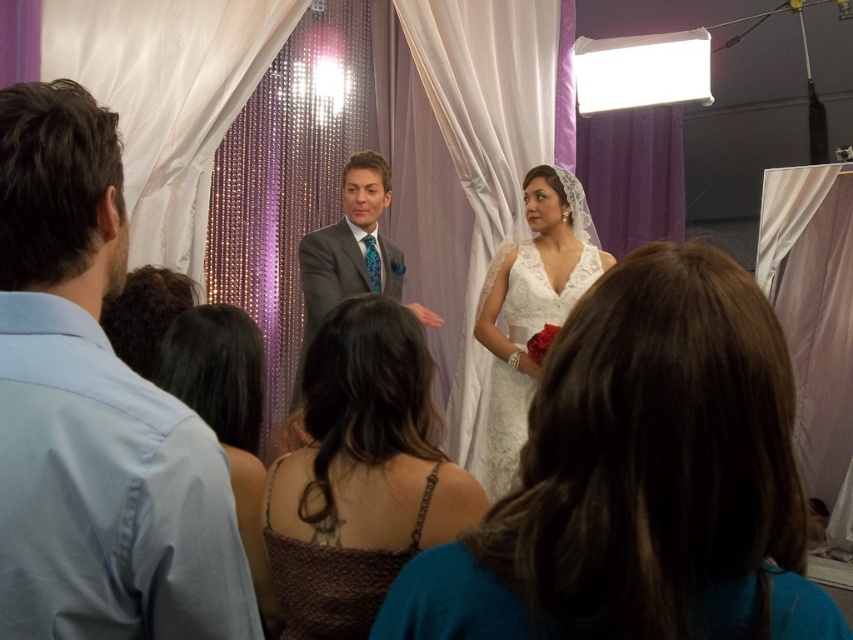
Which is below, light blue shirt at left or lace fabric dress at center?

Positioned lower is lace fabric dress at center.

Can you confirm if light blue shirt at left is thinner than lace fabric dress at center?

Indeed, light blue shirt at left has a lesser width compared to lace fabric dress at center.

Is point (82, 173) in front of point (491, 412)?

Yes, it is.

I want to click on light blue shirt at left, so click(94, 412).

Who is more forward, (544, 301) or (311, 317)?

Positioned in front is point (544, 301).

Can you confirm if lace fabric dress at center is smaller than gray suit at center?

Actually, lace fabric dress at center might be larger than gray suit at center.

Locate an element on the screen. The height and width of the screenshot is (640, 853). lace fabric dress at center is located at coordinates (531, 308).

From the picture: How far apart are white lace dress at center and light blue shirt at left?

A distance of 15.65 inches exists between white lace dress at center and light blue shirt at left.

The height and width of the screenshot is (640, 853). What do you see at coordinates (641, 480) in the screenshot? I see `white lace dress at center` at bounding box center [641, 480].

Does point (538, 620) come behind point (15, 292)?

No, (538, 620) is closer to viewer.

At what (x,y) coordinates should I click in order to perform the action: click on white lace dress at center. Please return your answer as a coordinate pair (x, y). The height and width of the screenshot is (640, 853). Looking at the image, I should click on (641, 480).